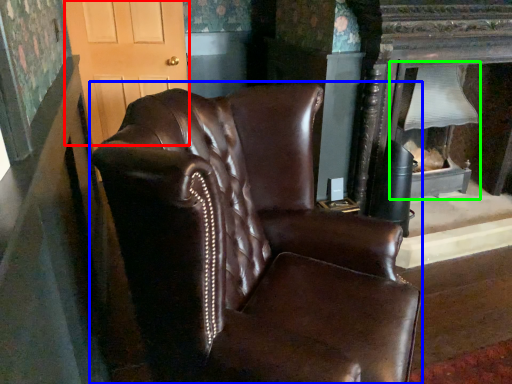
Question: Which is nearer to the glass door (highlighted by a red box)? chair (highlighted by a blue box) or fireplace (highlighted by a green box).

Choices:
 (A) chair
 (B) fireplace

Answer: (B)